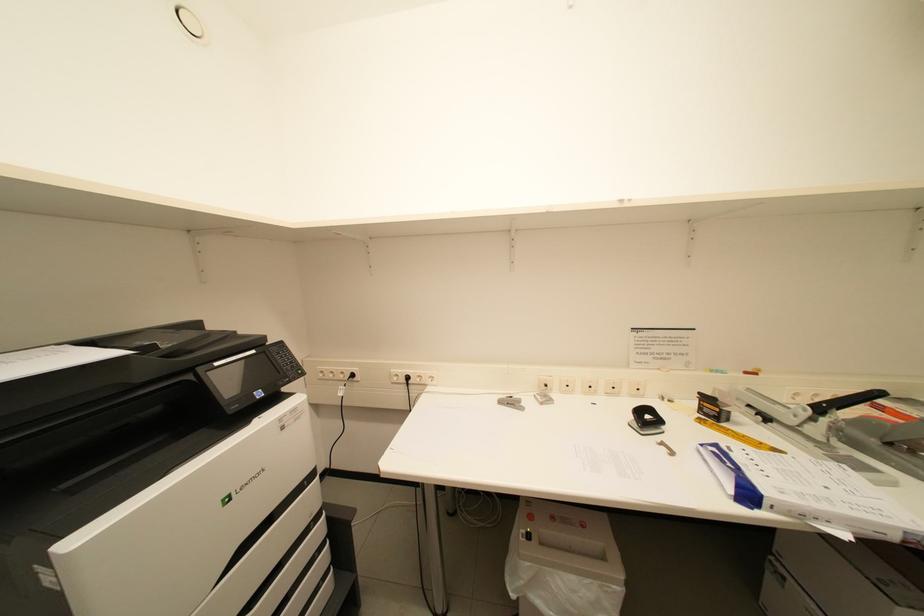
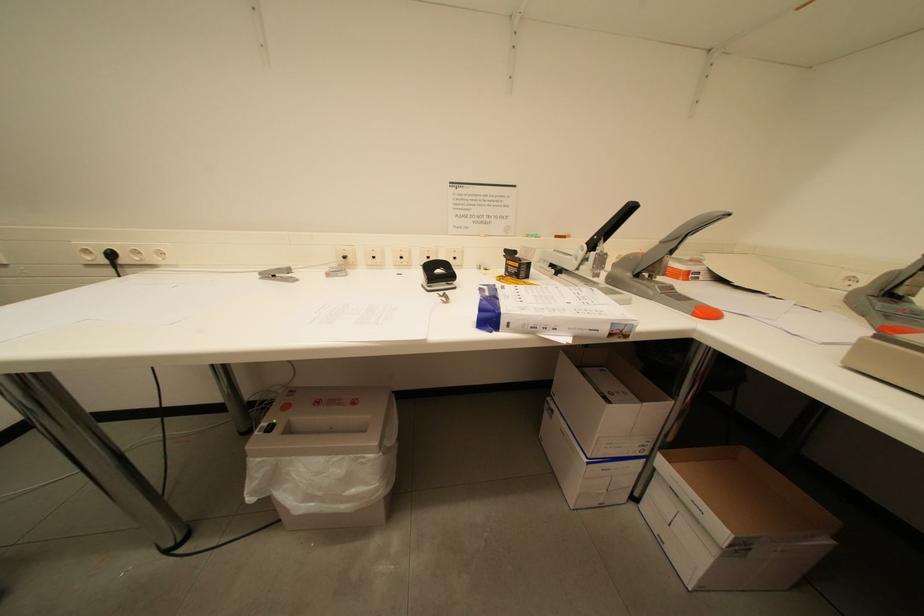
Question: Based on the continuous images, in which direction is the camera rotating? Reply with the corresponding letter.

Choices:
 (A) Left
 (B) Right
 (C) Up
 (D) Down

Answer: (B)